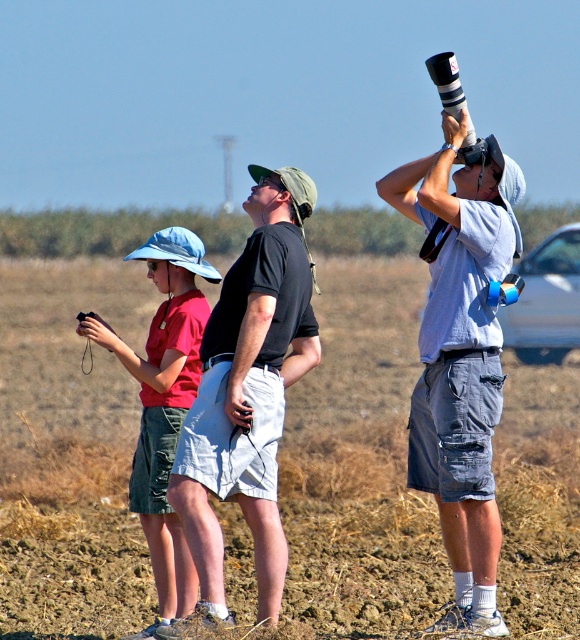
Between gray cotton shirt at upper right and black cotton shirt at center, which one appears on the right side from the viewer's perspective?

From the viewer's perspective, gray cotton shirt at upper right appears more on the right side.

Find the location of `gray cotton shirt at upper right`. gray cotton shirt at upper right is located at coordinates (461, 358).

Find the location of `gray cotton shirt at upper right`. gray cotton shirt at upper right is located at coordinates (461, 358).

Which is more to the left, black cotton shirt at center or matte red shirt at left?

From the viewer's perspective, matte red shirt at left appears more on the left side.

Does black cotton shirt at center have a greater height compared to matte red shirt at left?

In fact, black cotton shirt at center may be shorter than matte red shirt at left.

Find the location of a particular element. The image size is (580, 640). black cotton shirt at center is located at coordinates (248, 392).

Can you confirm if brown soil at center is wider than gray cotton shirt at upper right?

Indeed, brown soil at center has a greater width compared to gray cotton shirt at upper right.

How far apart are brown soil at center and gray cotton shirt at upper right?

11.00 meters

Is point (404, 259) less distant than point (491, 180)?

No, it is behind (491, 180).

The height and width of the screenshot is (640, 580). Identify the location of brown soil at center. (68, 454).